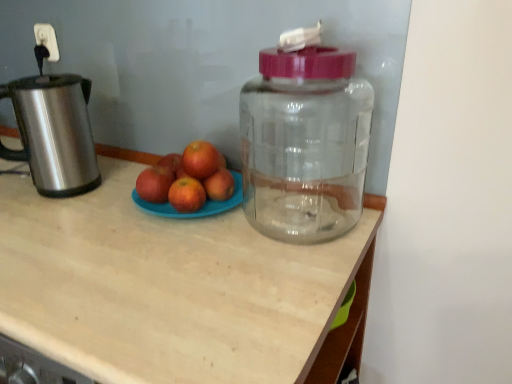
Question: Can you confirm if red matte apple at center, which ranks as the 1th apple in right-to-left order, is shorter than brushed metal kettle at left?

Choices:
 (A) no
 (B) yes

Answer: (B)

Question: Is brushed metal kettle at left at the back of red matte apple at center, which ranks as the 1th apple in right-to-left order?

Choices:
 (A) yes
 (B) no

Answer: (B)

Question: Does red matte apple at center, acting as the second apple starting from the left, appear on the right side of brushed metal kettle at left?

Choices:
 (A) yes
 (B) no

Answer: (A)

Question: From the image's perspective, is red matte apple at center, which ranks as the 1th apple in right-to-left order, beneath brushed metal kettle at left?

Choices:
 (A) no
 (B) yes

Answer: (B)

Question: Is there a large distance between red matte apple at center, acting as the second apple starting from the left, and brushed metal kettle at left?

Choices:
 (A) yes
 (B) no

Answer: (B)

Question: From a real-world perspective, relative to brushed metal kettle at left, is red matte grapefruit at center, the first grapefruit when ordered from bottom to top, vertically above or below?

Choices:
 (A) below
 (B) above

Answer: (A)

Question: Choose the correct answer: Is red matte grapefruit at center, which is the second grapefruit from top to bottom, inside brushed metal kettle at left or outside it?

Choices:
 (A) inside
 (B) outside

Answer: (B)

Question: Looking at their shapes, would you say red matte grapefruit at center, which is the second grapefruit from top to bottom, is wider or thinner than brushed metal kettle at left?

Choices:
 (A) wide
 (B) thin

Answer: (B)

Question: Would you say red matte grapefruit at center, the first grapefruit when ordered from bottom to top, is to the left or to the right of brushed metal kettle at left in the picture?

Choices:
 (A) left
 (B) right

Answer: (B)

Question: Considering the relative positions of red matte grapefruit at center, which is the second grapefruit from top to bottom, and red matte apple at center, the first apple viewed from the left, in the image provided, is red matte grapefruit at center, which is the second grapefruit from top to bottom, to the left or to the right of red matte apple at center, the first apple viewed from the left,?

Choices:
 (A) left
 (B) right

Answer: (B)

Question: Considering the positions of red matte grapefruit at center, which is the second grapefruit from top to bottom, and red matte apple at center, the first apple viewed from the left, in the image, is red matte grapefruit at center, which is the second grapefruit from top to bottom, bigger or smaller than red matte apple at center, the first apple viewed from the left,?

Choices:
 (A) small
 (B) big

Answer: (A)

Question: Relative to red matte apple at center, the first apple viewed from the left, is red matte grapefruit at center, which is the second grapefruit from top to bottom, in front or behind?

Choices:
 (A) front
 (B) behind

Answer: (A)

Question: From a real-world perspective, is red matte grapefruit at center, the first grapefruit when ordered from bottom to top, above or below red matte apple at center, which ranks as the second apple in right-to-left order?

Choices:
 (A) above
 (B) below

Answer: (B)

Question: Would you say red matte apple at center, which ranks as the 1th apple in right-to-left order, is to the left or to the right of red matte grapefruit at center, which appears as the 1th grapefruit when viewed from the top, in the picture?

Choices:
 (A) left
 (B) right

Answer: (B)

Question: Is red matte apple at center, which ranks as the 1th apple in right-to-left order, spatially inside red matte grapefruit at center, which appears as the 1th grapefruit when viewed from the top, or outside of it?

Choices:
 (A) outside
 (B) inside

Answer: (A)